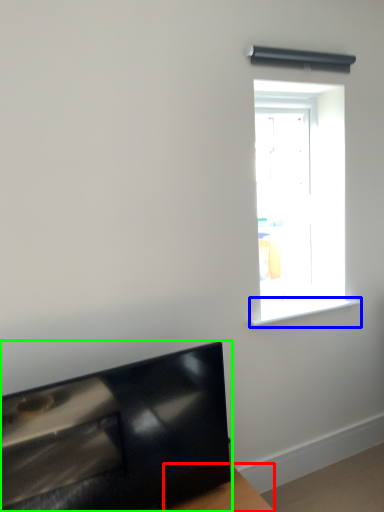
Question: Which object is positioned farthest from table (highlighted by a red box)? Select from window sill (highlighted by a blue box) and furniture (highlighted by a green box).

Choices:
 (A) window sill
 (B) furniture

Answer: (A)